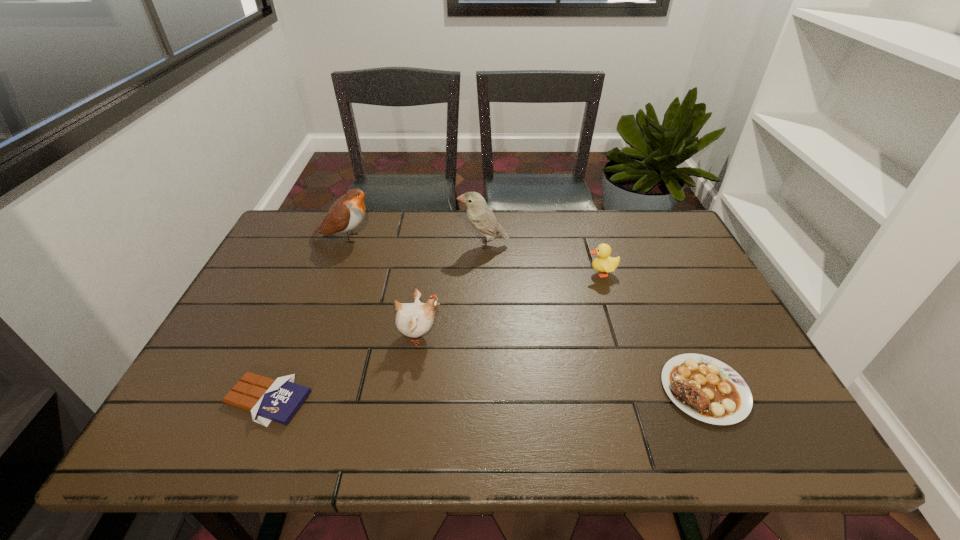
Locate an element on the screen. vacant region between the fourth shortest object and the fourth tallest object is located at coordinates (510, 304).

Image resolution: width=960 pixels, height=540 pixels. Identify the location of free space between the fourth tallest object and the leftmost bird. point(473,255).

Where is `free space between the leftmost bird and the rightmost object`? Image resolution: width=960 pixels, height=540 pixels. free space between the leftmost bird and the rightmost object is located at coordinates (524, 314).

The width and height of the screenshot is (960, 540). I want to click on vacant space that is in between the chocolate bar and the rightmost bird, so click(x=375, y=322).

Locate which object is the fifth closest to the second object from right to left. Please provide its 2D coordinates. Your answer should be formatted as a tuple, i.e. [(x, y)], where the tuple contains the x and y coordinates of a point satisfying the conditions above.

[(267, 399)]

The width and height of the screenshot is (960, 540). What are the coordinates of `the closest object to the duckling` in the screenshot? It's located at (481, 217).

The width and height of the screenshot is (960, 540). What are the coordinates of `bird that is the second closest to the steak` in the screenshot? It's located at (481, 217).

At what (x,y) coordinates should I click in order to perform the action: click on the second closest bird to the rightmost bird. Please return your answer as a coordinate pair (x, y). This screenshot has height=540, width=960. Looking at the image, I should click on (346, 213).

Image resolution: width=960 pixels, height=540 pixels. I want to click on free location that satisfies the following two spatial constraints: 1. at the beak of the fourth object from right to left; 2. on the left side of the rightmost object, so click(x=411, y=389).

At what (x,y) coordinates should I click in order to perform the action: click on free space that satisfies the following two spatial constraints: 1. at the face of the leftmost bird; 2. on the right side of the rightmost object. Please return your answer as a coordinate pair (x, y). This screenshot has width=960, height=540. Looking at the image, I should click on (285, 389).